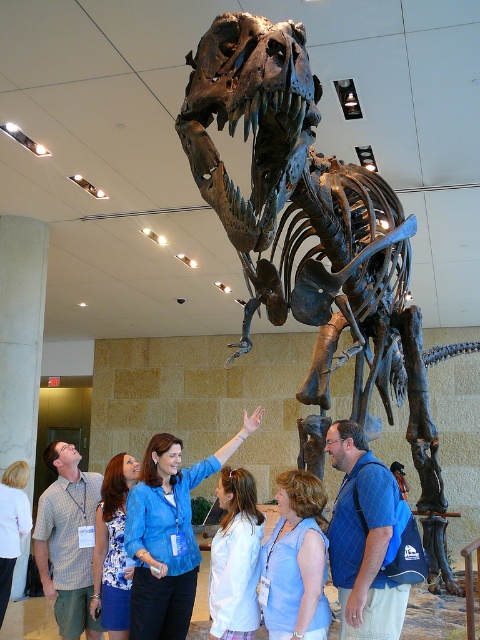
You are a museum visitor who wants to take a photo of the shiny metallic skeleton at center without the blue shirt at upper center appearing in the shot. Is this possible given their sizes?

The shiny metallic skeleton at center is bigger than the blue shirt at upper center, so it depends on the camera angle and distance. If you move closer to the skeleton and frame the shot carefully, you can likely exclude the blue shirt at upper center by focusing on the larger skeleton.

You are standing in a museum and want to take a photo of the shiny metallic skeleton at center without anyone blocking your view. The group of people is nearby. Is there enough space between you and the skeleton to move around freely?

The shiny metallic skeleton at center and viewer are 6.68 feet apart from each other. This distance allows enough space to move around freely without obstruction from the nearby group, provided they don not block your path.